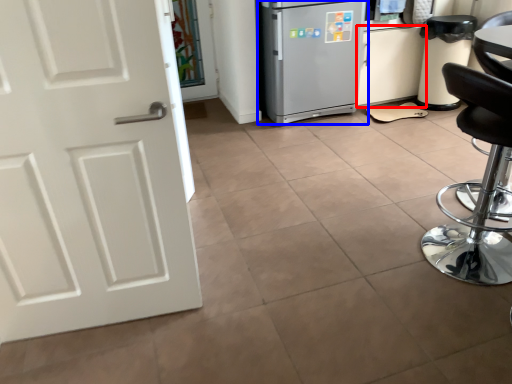
Question: Which object appears closest to the camera in this image, cabinetry (highlighted by a red box) or refrigerator (highlighted by a blue box)?

Choices:
 (A) cabinetry
 (B) refrigerator

Answer: (B)